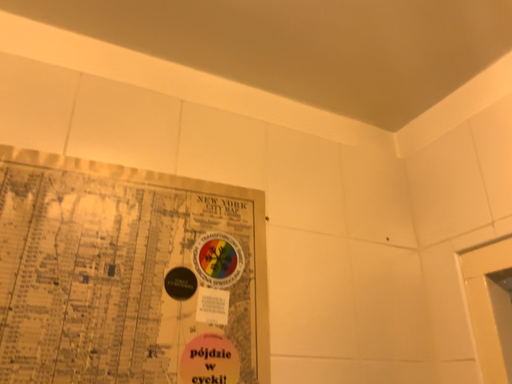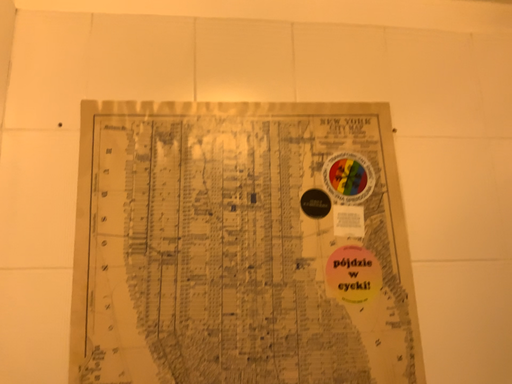
Question: How did the camera likely rotate when shooting the video?

Choices:
 (A) rotated upward
 (B) rotated downward

Answer: (B)